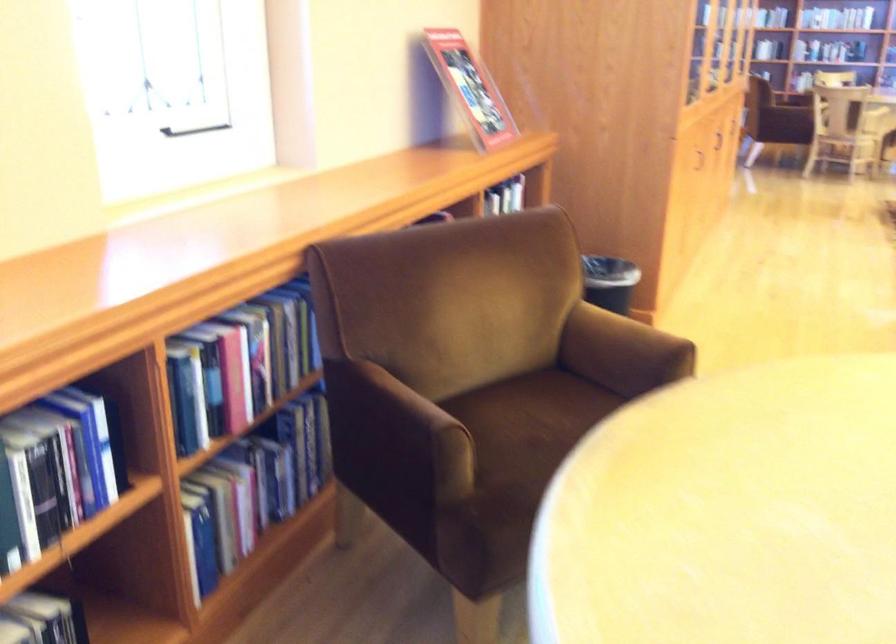
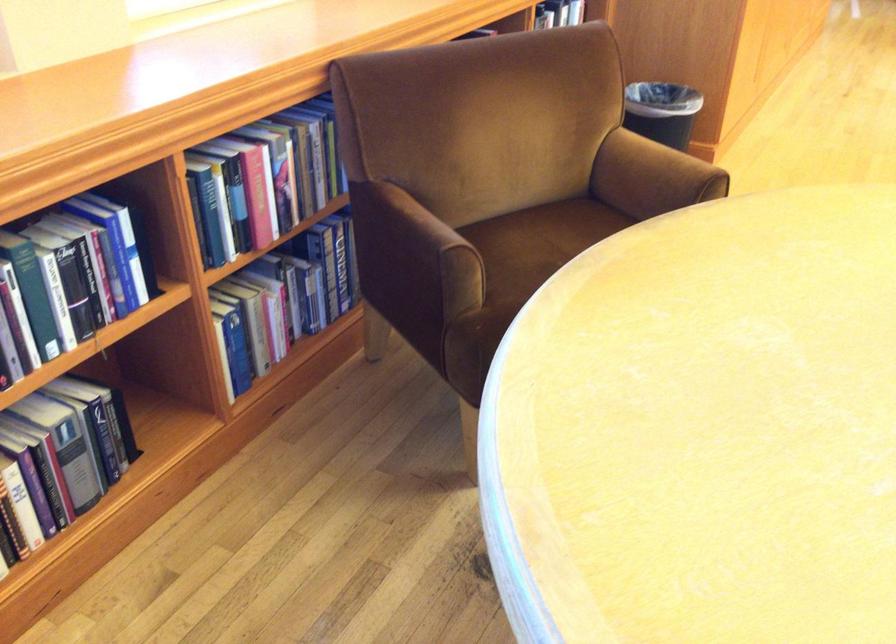
Find the pixel in the second image that matches pixel 253 488 in the first image.

(282, 299)